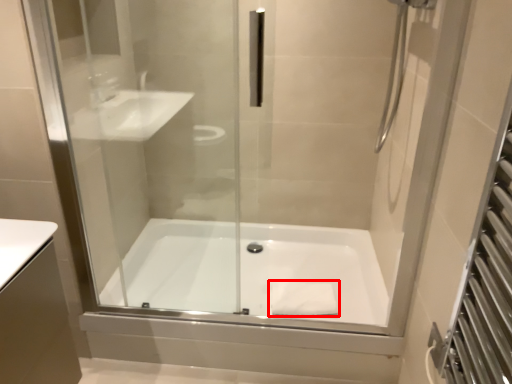
Question: From the image's perspective, what is the correct spatial relationship of material (annotated by the red box) in relation to bathtub?

Choices:
 (A) below
 (B) above

Answer: (A)